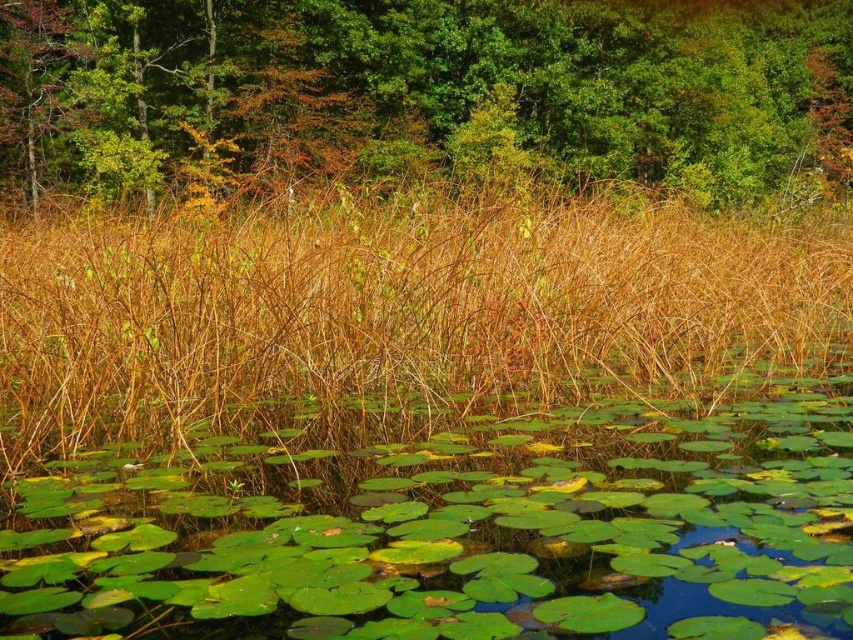
Consider the image. You are standing on the edge of the pond and notice the green glossy lily pads at center and the green leafy tree at upper center. Which object is positioned higher from the ground?

The green leafy tree at upper center is positioned higher from the ground than the green glossy lily pads at center because it is located above them.

You are standing at the edge of the pond and want to reach two points marked in the image. Which point, point (451, 593) or point (148, 390), is closer to you?

Point (451, 593) is closer to you than point (148, 390).